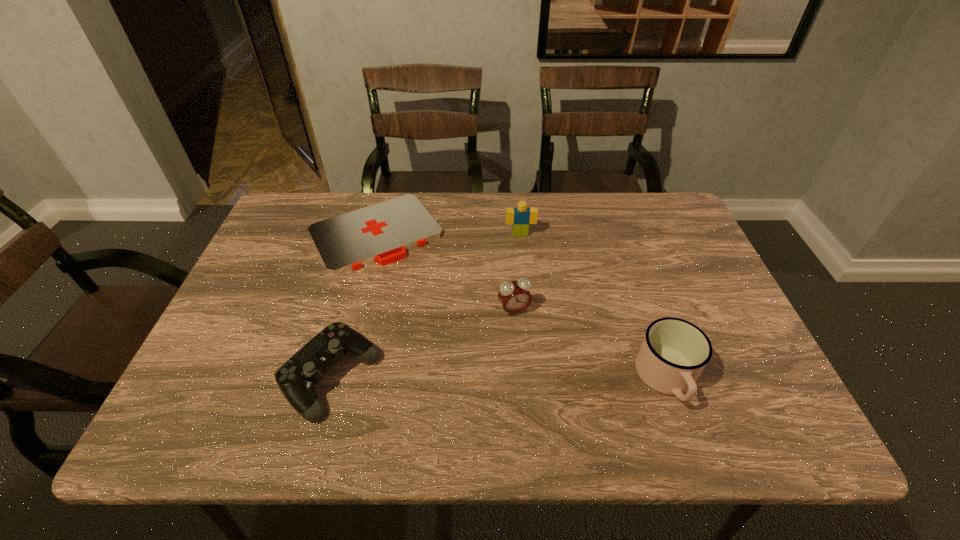
In order to click on vacant space on the desktop that is between the control and the rightmost object and is positioned on handle side the shortest object in this screenshot , I will do `click(470, 379)`.

Find the location of a particular element. The width and height of the screenshot is (960, 540). free spot on the desktop that is between the second shortest object and the rightmost object and is positioned on the face of the Lego is located at coordinates (543, 379).

Locate an element on the screen. free space on the desktop that is between the second shortest object and the rightmost object and is positioned on the clock face of the third farthest object is located at coordinates (548, 379).